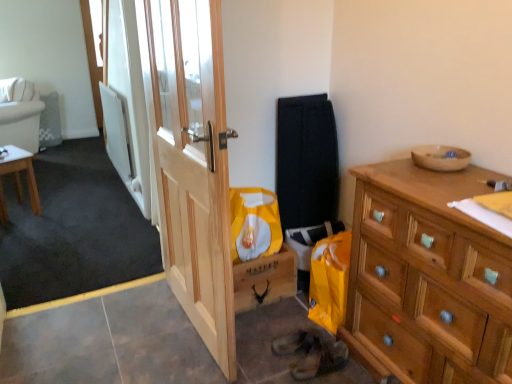
Where is `free space in front of wooden bowl at upper right`? The image size is (512, 384). free space in front of wooden bowl at upper right is located at coordinates (472, 178).